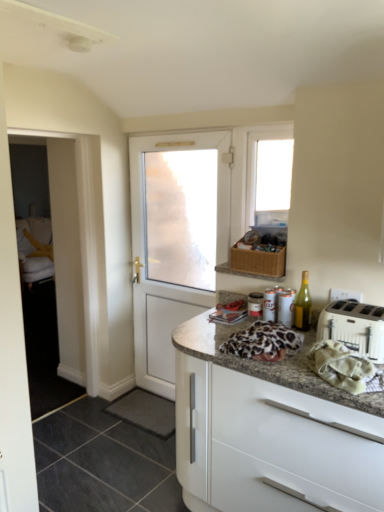
Question: Would you say transparent glass window at upper center is inside or outside black rubber mat at lower center, which is the 1th tile from back to front?

Choices:
 (A) outside
 (B) inside

Answer: (A)

Question: In the image, is transparent glass window at upper center positioned in front of or behind black rubber mat at lower center, which is the 1th tile from back to front?

Choices:
 (A) front
 (B) behind

Answer: (A)

Question: Estimate the real-world distances between objects in this image. Which object is farther from the black rubber mat at lower center, which is the 1th tile from back to front?

Choices:
 (A) white glossy cabinet at lower right
 (B) white glossy screen door at left
 (C) metallic silver canister at upper right
 (D) white plastic toaster at right
 (E) green glass bottle at right

Answer: (D)

Question: Considering the real-world distances, which object is closest to the white glossy screen door at left?

Choices:
 (A) green glass bottle at right
 (B) black rubber mat at lower center, which is the 1th tile from back to front
 (C) white matte door at center
 (D) white glossy cabinet at lower right
 (E) white cloth at right

Answer: (C)